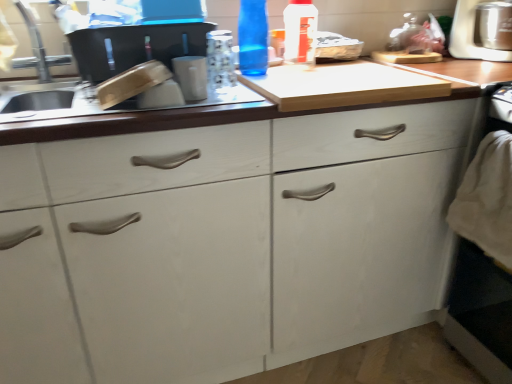
Question: Could you tell me if transparent plastic bottle at upper center, which is counted as the 2th bottle, starting from the left, is facing blue glass bottle at upper center, arranged as the second bottle when viewed from the right?

Choices:
 (A) yes
 (B) no

Answer: (B)

Question: Considering the relative positions of transparent plastic bottle at upper center, which is counted as the 2th bottle, starting from the left, and blue glass bottle at upper center, arranged as the second bottle when viewed from the right, in the image provided, is transparent plastic bottle at upper center, which is counted as the 2th bottle, starting from the left, to the right of blue glass bottle at upper center, arranged as the second bottle when viewed from the right, from the viewer's perspective?

Choices:
 (A) yes
 (B) no

Answer: (A)

Question: Considering the relative sizes of transparent plastic bottle at upper center, marked as the 1th bottle in a right-to-left arrangement, and blue glass bottle at upper center, the 1th bottle when ordered from left to right, in the image provided, is transparent plastic bottle at upper center, marked as the 1th bottle in a right-to-left arrangement, thinner than blue glass bottle at upper center, the 1th bottle when ordered from left to right,?

Choices:
 (A) no
 (B) yes

Answer: (B)

Question: From the image's perspective, does transparent plastic bottle at upper center, marked as the 1th bottle in a right-to-left arrangement, appear higher than blue glass bottle at upper center, arranged as the second bottle when viewed from the right?

Choices:
 (A) no
 (B) yes

Answer: (B)

Question: Is transparent plastic bottle at upper center, which is counted as the 2th bottle, starting from the left, far from blue glass bottle at upper center, arranged as the second bottle when viewed from the right?

Choices:
 (A) yes
 (B) no

Answer: (B)

Question: Is white matte cabinet at center inside or outside of blue glass bottle at upper center, the 1th bottle when ordered from left to right?

Choices:
 (A) outside
 (B) inside

Answer: (A)

Question: In terms of height, does white matte cabinet at center look taller or shorter compared to blue glass bottle at upper center, arranged as the second bottle when viewed from the right?

Choices:
 (A) short
 (B) tall

Answer: (B)

Question: Visually, is white matte cabinet at center positioned to the left or to the right of blue glass bottle at upper center, arranged as the second bottle when viewed from the right?

Choices:
 (A) left
 (B) right

Answer: (B)

Question: Is point (459, 153) positioned closer to the camera than point (246, 29)?

Choices:
 (A) farther
 (B) closer

Answer: (B)

Question: Looking at their shapes, would you say brushed metal faucet at upper left is wider or thinner than white matte cabinet at center?

Choices:
 (A) thin
 (B) wide

Answer: (A)

Question: Is brushed metal faucet at upper left in front of or behind white matte cabinet at center in the image?

Choices:
 (A) front
 (B) behind

Answer: (B)

Question: Considering the positions of point (34, 52) and point (334, 125), is point (34, 52) closer or farther from the camera than point (334, 125)?

Choices:
 (A) farther
 (B) closer

Answer: (A)

Question: From the image's perspective, relative to white matte cabinet at center, is brushed metal faucet at upper left above or below?

Choices:
 (A) below
 (B) above

Answer: (B)

Question: From the image's perspective, relative to stainless steel food processor at upper right, is white matte cabinet at center above or below?

Choices:
 (A) below
 (B) above

Answer: (A)

Question: Which is correct: white matte cabinet at center is inside stainless steel food processor at upper right, or outside of it?

Choices:
 (A) outside
 (B) inside

Answer: (A)